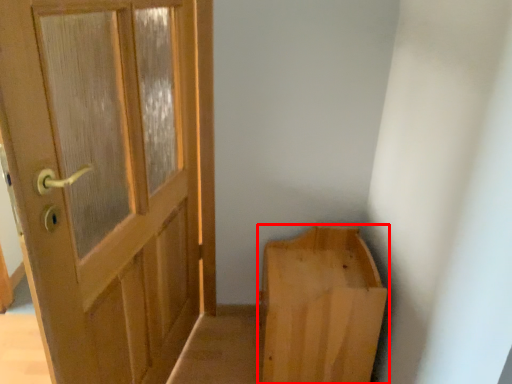
Question: Observing the image, what is the correct spatial positioning of furniture (annotated by the red box) in reference to door?

Choices:
 (A) left
 (B) right

Answer: (B)